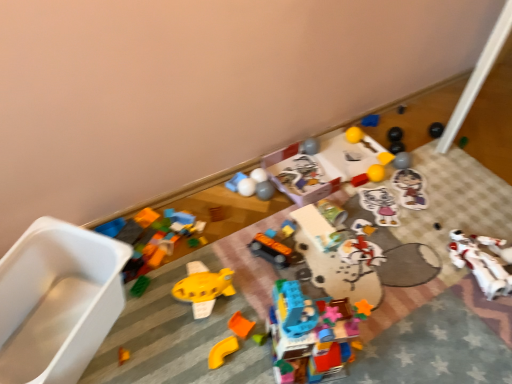
Where is `free area in between yellow rubber ball at upper center, the 3th toy in the right-to-left sequence, and white plastic robot at lower right, the first toy positioned from the right`? The image size is (512, 384). free area in between yellow rubber ball at upper center, the 3th toy in the right-to-left sequence, and white plastic robot at lower right, the first toy positioned from the right is located at coordinates (423, 204).